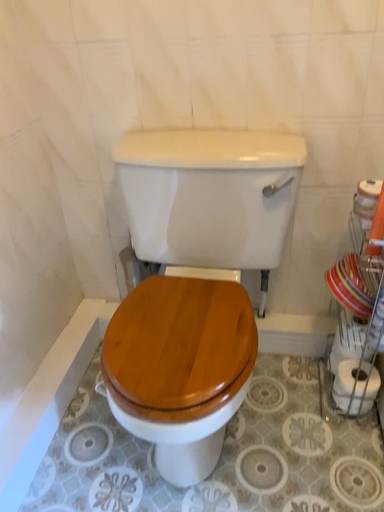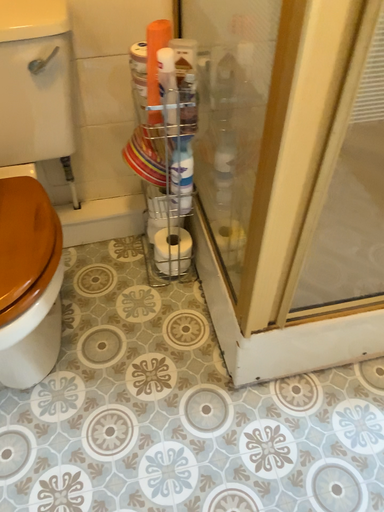
Question: Which way did the camera rotate in the video?

Choices:
 (A) rotated right
 (B) rotated left

Answer: (A)